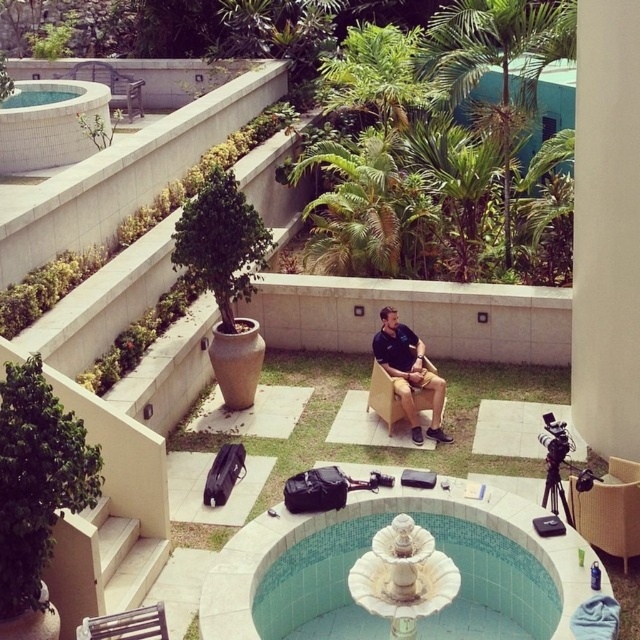
Question: Which object is positioned closest to the white ceramic jacuzzi at upper left?

Choices:
 (A) metallic silver chair at lower left
 (B) wooden chair at center
 (C) rattan chair at center

Answer: (B)

Question: Can you confirm if white ceramic fountain at center is smaller than white ceramic jacuzzi at upper left?

Choices:
 (A) no
 (B) yes

Answer: (B)

Question: Is white ceramic jacuzzi at upper left positioned at the back of metallic silver chair at lower left?

Choices:
 (A) yes
 (B) no

Answer: (A)

Question: Estimate the real-world distances between objects in this image. Which object is closer to the white ceramic jacuzzi at upper left?

Choices:
 (A) rattan chair at center
 (B) metallic silver chair at lower left
 (C) white ceramic fountain at center
 (D) wooden chair at center

Answer: (D)

Question: Among these objects, which one is farthest from the camera?

Choices:
 (A) white ceramic jacuzzi at upper left
 (B) wooden chair at center
 (C) metallic silver chair at lower left

Answer: (A)

Question: Is the position of white ceramic fountain at center less distant than that of wooden chair at center?

Choices:
 (A) yes
 (B) no

Answer: (A)